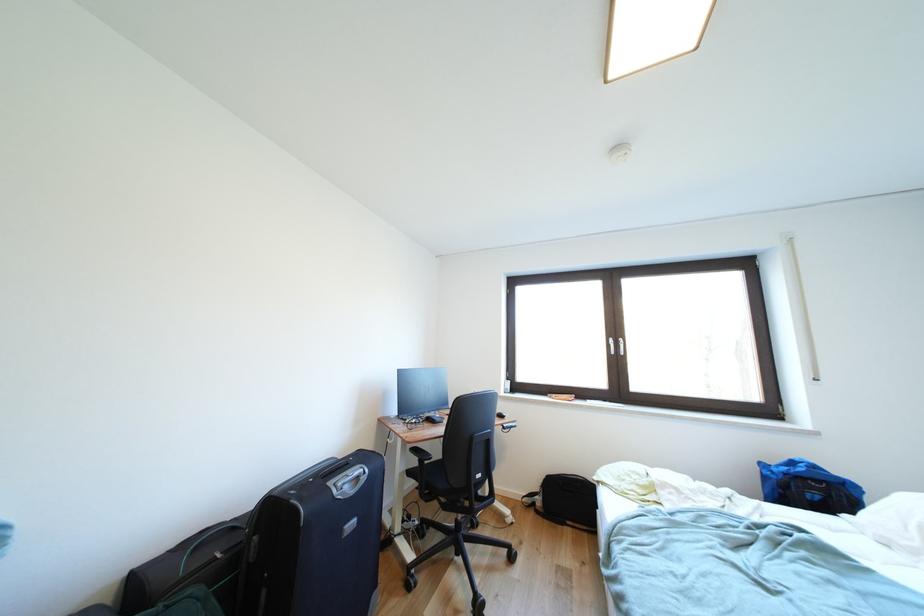
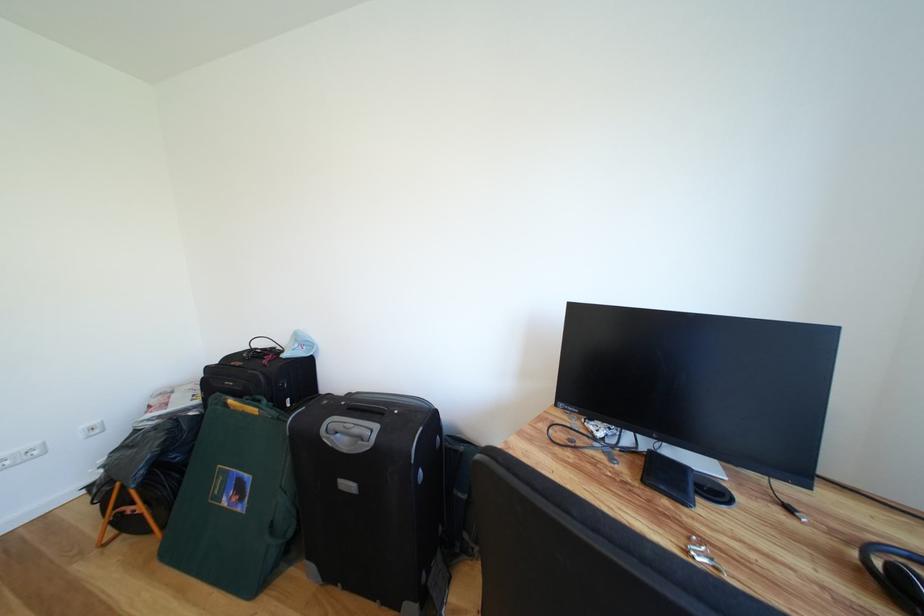
In the second image, find the point that corresponds to point 360,496 in the first image.

(353, 455)